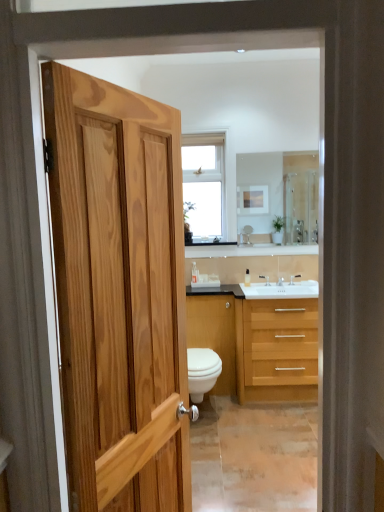
Question: Does clear glass mirror at upper center lie behind white glossy toilet at center?

Choices:
 (A) no
 (B) yes

Answer: (B)

Question: Does clear glass mirror at upper center have a smaller size compared to white glossy toilet at center?

Choices:
 (A) no
 (B) yes

Answer: (B)

Question: Is clear glass mirror at upper center directly adjacent to white glossy toilet at center?

Choices:
 (A) yes
 (B) no

Answer: (B)

Question: Is white glossy toilet at center completely or partially inside clear glass mirror at upper center?

Choices:
 (A) no
 (B) yes

Answer: (A)

Question: Does clear glass mirror at upper center have a greater width compared to white glossy toilet at center?

Choices:
 (A) yes
 (B) no

Answer: (B)

Question: Looking at the image, does white glossy toilet at center seem bigger or smaller compared to clear glass mirror at upper center?

Choices:
 (A) small
 (B) big

Answer: (B)

Question: Considering the positions of point (187, 354) and point (316, 205), is point (187, 354) closer or farther from the camera than point (316, 205)?

Choices:
 (A) farther
 (B) closer

Answer: (B)

Question: From a real-world perspective, is white glossy toilet at center above or below clear glass mirror at upper center?

Choices:
 (A) below
 (B) above

Answer: (A)

Question: Do you think white glossy toilet at center is within clear glass mirror at upper center, or outside of it?

Choices:
 (A) outside
 (B) inside

Answer: (A)

Question: From the image's perspective, relative to white glossy cabinet at center, is white glossy toilet at center above or below?

Choices:
 (A) above
 (B) below

Answer: (B)

Question: Is white glossy toilet at center to the left or to the right of white glossy cabinet at center in the image?

Choices:
 (A) right
 (B) left

Answer: (B)

Question: From their relative heights in the image, would you say white glossy toilet at center is taller or shorter than white glossy cabinet at center?

Choices:
 (A) tall
 (B) short

Answer: (B)

Question: Is white glossy toilet at center inside the boundaries of white glossy cabinet at center, or outside?

Choices:
 (A) outside
 (B) inside

Answer: (A)

Question: Choose the correct answer: Is clear glass mirror at upper center inside silver metallic faucet at center, which is the first faucet from right to left, or outside it?

Choices:
 (A) inside
 (B) outside

Answer: (B)

Question: Based on their sizes in the image, would you say clear glass mirror at upper center is bigger or smaller than silver metallic faucet at center, which is the first faucet from right to left?

Choices:
 (A) small
 (B) big

Answer: (B)